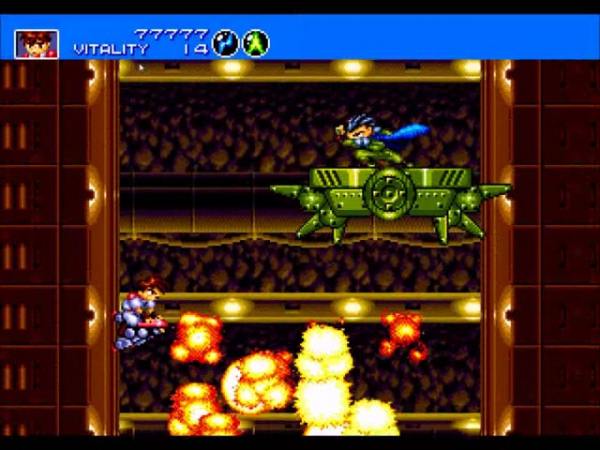
Identify the location of walls. (546, 335), (47, 318).